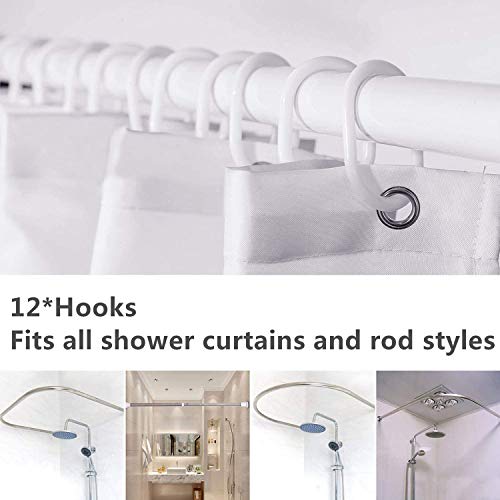
Where is `hook`? The image size is (500, 500). hook is located at coordinates (235, 125).